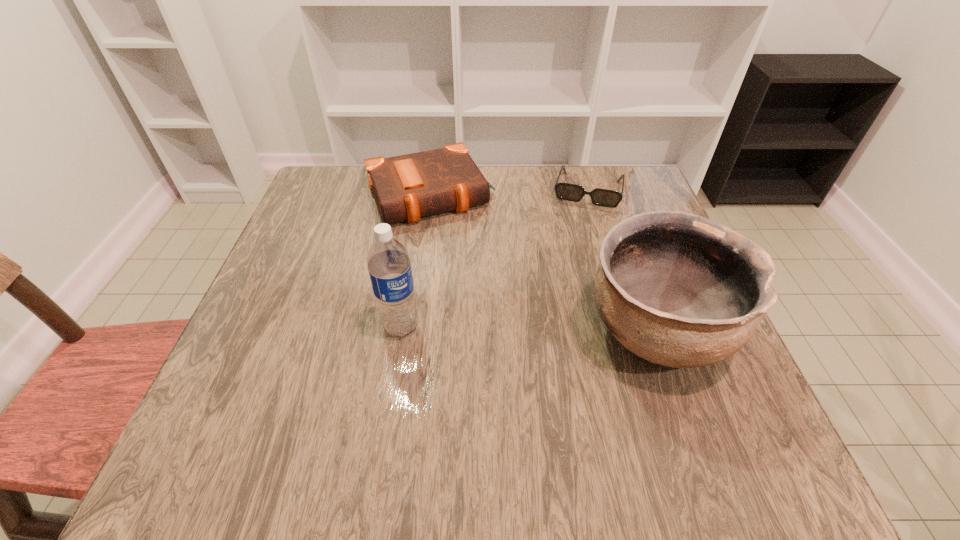
This screenshot has height=540, width=960. In order to click on water bottle in this screenshot , I will do `click(389, 266)`.

What are the coordinates of `pottery` in the screenshot? It's located at (677, 289).

Where is `sunglasses`? The height and width of the screenshot is (540, 960). sunglasses is located at coordinates (571, 192).

What are the coordinates of `the third tallest object` in the screenshot? It's located at (407, 187).

In order to click on free region located on the back of the water bottle in this screenshot , I will do `click(417, 228)`.

Identify the location of vacant area situated 0.140m on the back of the pottery. The image size is (960, 540). (623, 238).

What are the coordinates of `vacant area situated on the front-facing side of the shortest object` in the screenshot? It's located at (556, 328).

The width and height of the screenshot is (960, 540). I want to click on vacant space located on the front-facing side of the shortest object, so click(x=569, y=270).

Locate an element on the screen. Image resolution: width=960 pixels, height=540 pixels. vacant area situated 0.120m on the front-facing side of the shortest object is located at coordinates (576, 239).

Image resolution: width=960 pixels, height=540 pixels. I want to click on vacant space situated 0.070m on the spine side of the third tallest object, so click(x=459, y=247).